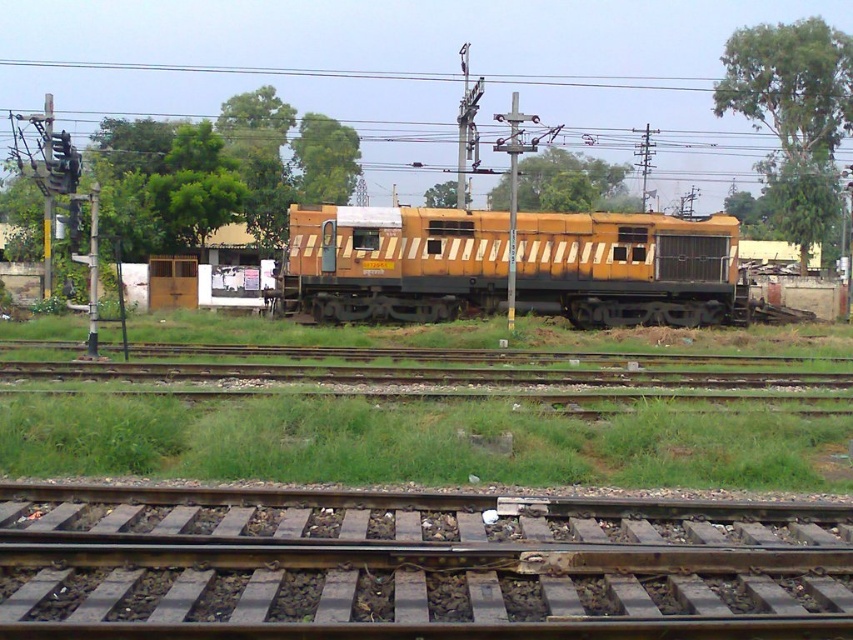
Question: Which of these objects is positioned farthest from the brown gravel train track at center?

Choices:
 (A) yellow matte locomotive at center
 (B) green grass at lower center

Answer: (A)

Question: Is green grass at lower center above yellow matte locomotive at center?

Choices:
 (A) yes
 (B) no

Answer: (B)

Question: Which of the following is the farthest from the observer?

Choices:
 (A) green grass at lower center
 (B) brown gravel train track at center
 (C) yellow matte locomotive at center

Answer: (C)

Question: Estimate the real-world distances between objects in this image. Which object is farther from the green grass at lower center?

Choices:
 (A) yellow matte locomotive at center
 (B) brown gravel train track at center

Answer: (A)

Question: Is brown gravel train track at center to the left of green grass at lower center from the viewer's perspective?

Choices:
 (A) no
 (B) yes

Answer: (A)

Question: Does brown gravel train track at center appear under green grass at lower center?

Choices:
 (A) no
 (B) yes

Answer: (B)